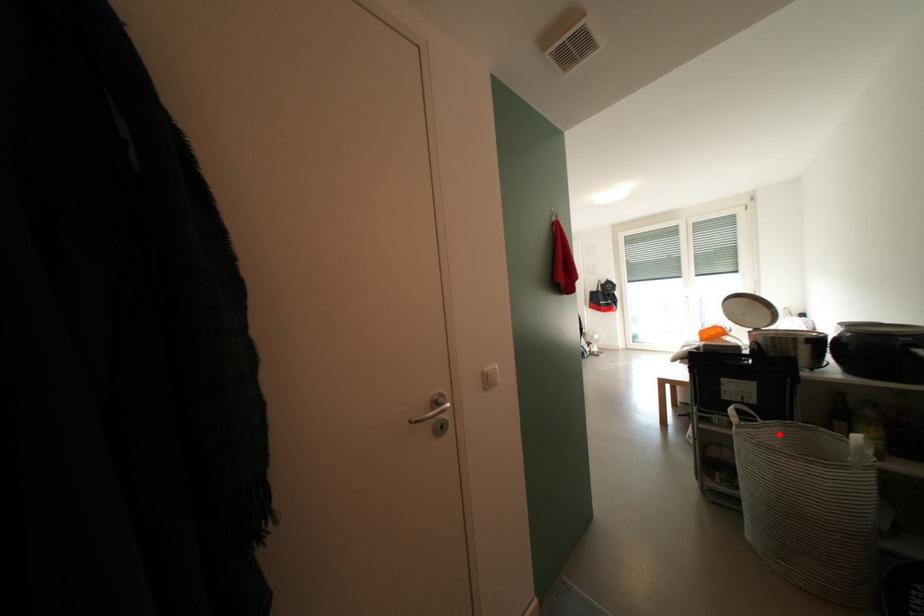
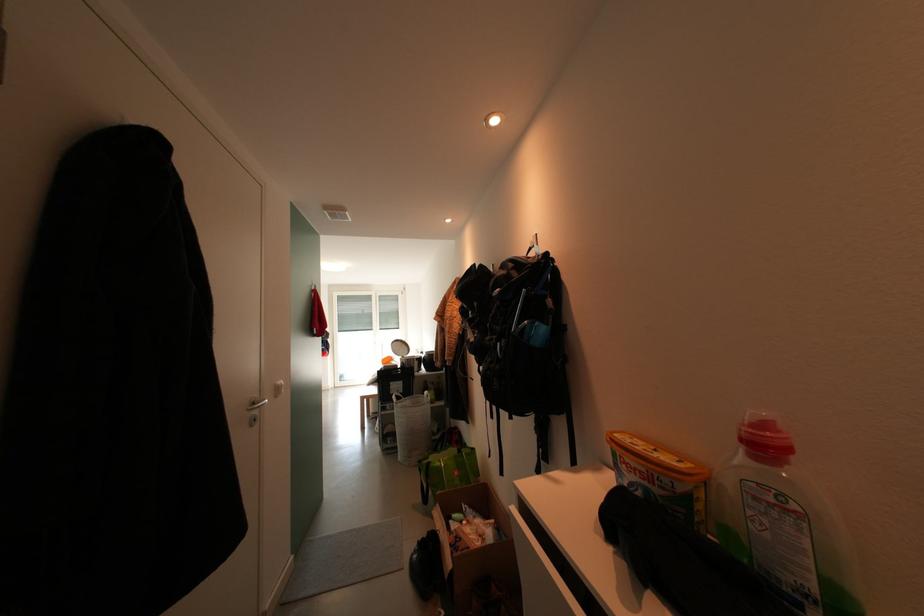
Question: I am providing you with two images of the same scene from different viewpoints. Given a red point in image1, look at the same physical point in image2. Is it:

Choices:
 (A) Closer to the viewpoint
 (B) Farther from the viewpoint

Answer: (B)